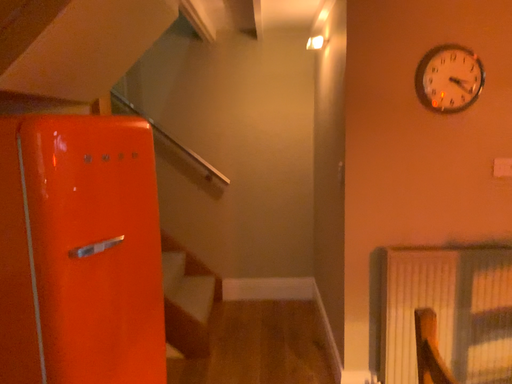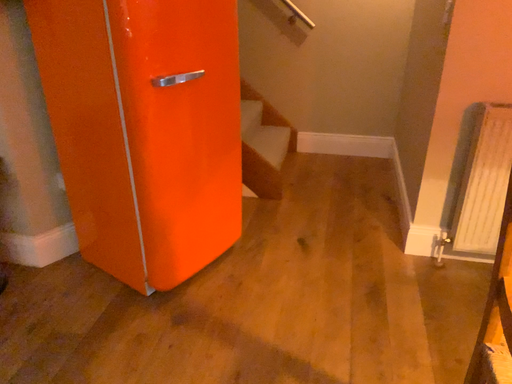
Question: How did the camera likely rotate when shooting the video?

Choices:
 (A) rotated upward
 (B) rotated downward

Answer: (B)